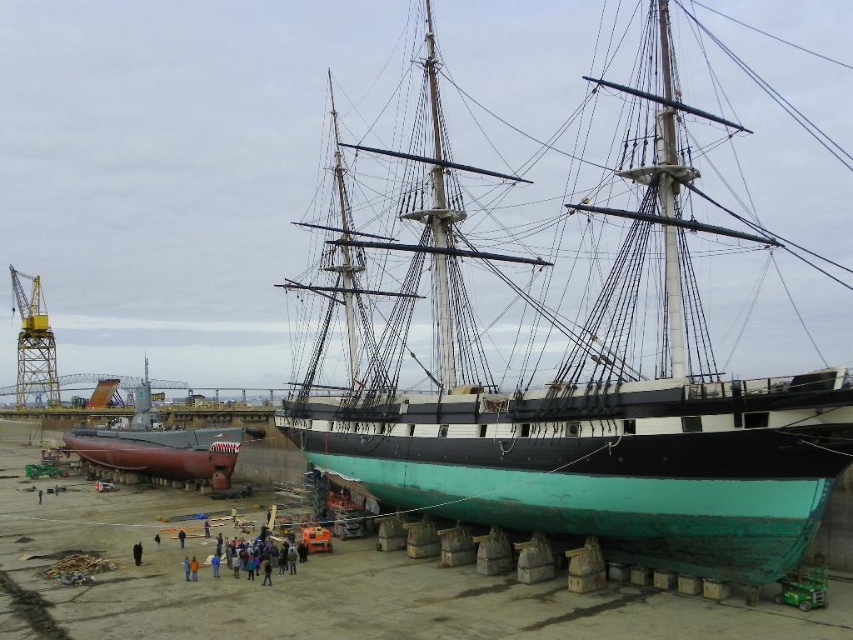
Question: Does dark blue jeans at lower center have a greater width compared to dark blue fabric at lower center?

Choices:
 (A) yes
 (B) no

Answer: (A)

Question: Estimate the real-world distances between objects in this image. Which object is farther from the dark blue jeans at lower center?

Choices:
 (A) dark blue fabric at lower center
 (B) matte red submarine at lower left
 (C) orange fabric person at center

Answer: (B)

Question: Among these objects, which one is farthest from the camera?

Choices:
 (A) blue denim jacket at center
 (B) matte red submarine at lower left
 (C) orange fabric person at center
 (D) yellow painted metal crane at left

Answer: (D)

Question: Can you confirm if blue denim jacket at center is wider than dark blue jeans at lower center?

Choices:
 (A) yes
 (B) no

Answer: (A)

Question: Which object appears closest to the camera in this image?

Choices:
 (A) teal matte ship at center
 (B) orange fabric person at center
 (C) dark blue fabric at lower center

Answer: (A)

Question: Does teal matte ship at center have a greater width compared to dark blue jeans at lower center?

Choices:
 (A) yes
 (B) no

Answer: (A)